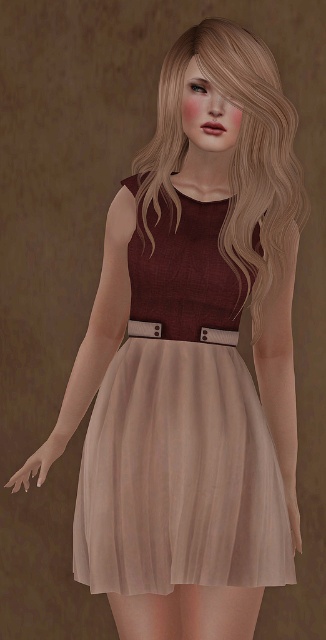
Question: Which point is closer to the camera?

Choices:
 (A) (211, 339)
 (B) (296, 172)

Answer: (A)

Question: Can you confirm if blondehair at center is positioned to the left of metallic silver belt at center?

Choices:
 (A) yes
 (B) no

Answer: (B)

Question: Which of the following is the farthest from the observer?

Choices:
 (A) (143, 326)
 (B) (222, 28)

Answer: (A)

Question: Which of the following is the closest to the observer?

Choices:
 (A) (283, 156)
 (B) (225, 332)

Answer: (A)

Question: Can you confirm if blondehair at center is positioned to the left of metallic silver belt at center?

Choices:
 (A) yes
 (B) no

Answer: (B)

Question: Where is blondehair at center located in relation to metallic silver belt at center in the image?

Choices:
 (A) above
 (B) below

Answer: (A)